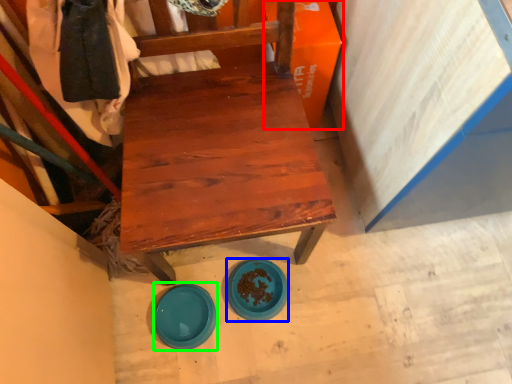
Question: Estimate the real-world distances between objects in this image. Which object is farther from cardboard box (highlighted by a red box), plate (highlighted by a blue box) or plate (highlighted by a green box)?

Choices:
 (A) plate
 (B) plate

Answer: (B)